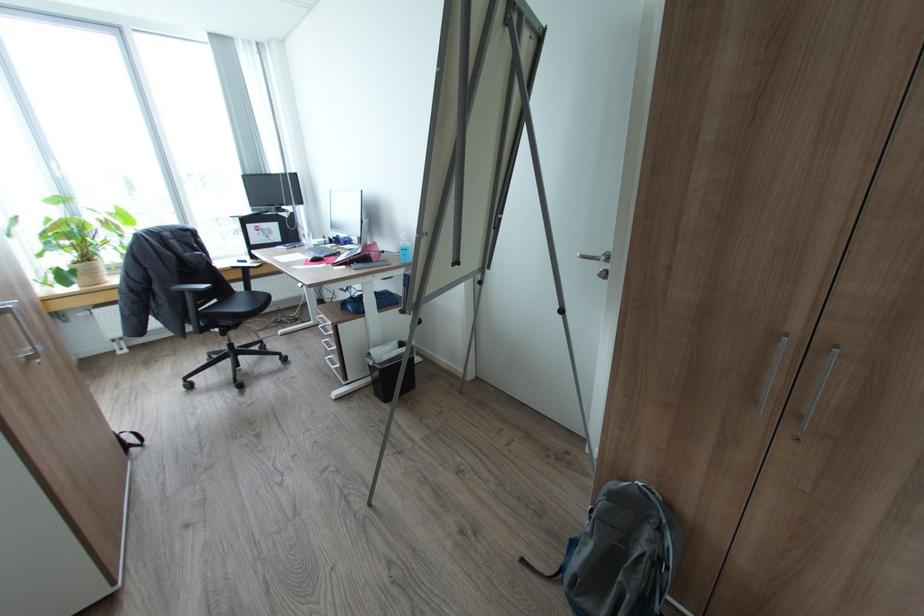
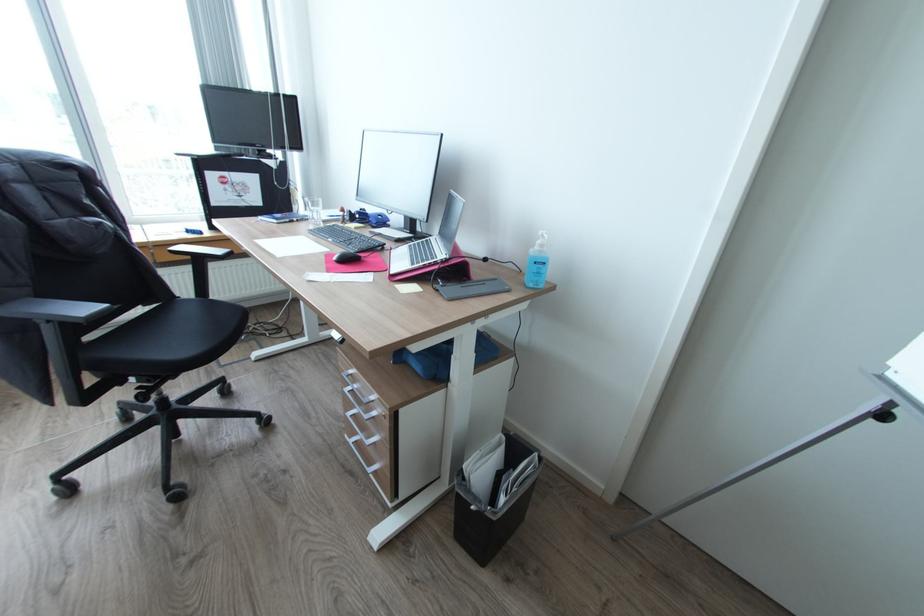
Which direction would the cameraman need to move to produce the second image?

The cameraman walked toward left, forward.